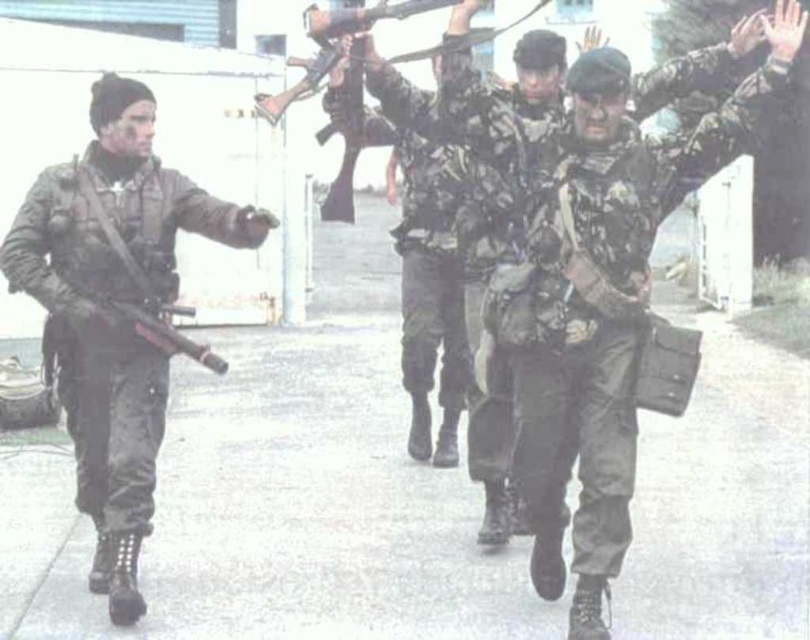
Who is higher up, camouflage uniform at left or camouflage fabric uniform at center?

camouflage fabric uniform at center

Who is lower down, camouflage uniform at left or camouflage fabric uniform at center?

camouflage uniform at left is below.

Is point (15, 228) farther from camera compared to point (548, 464)?

Yes, point (15, 228) is behind point (548, 464).

Find the location of a particular element. The width and height of the screenshot is (810, 640). camouflage uniform at left is located at coordinates (116, 310).